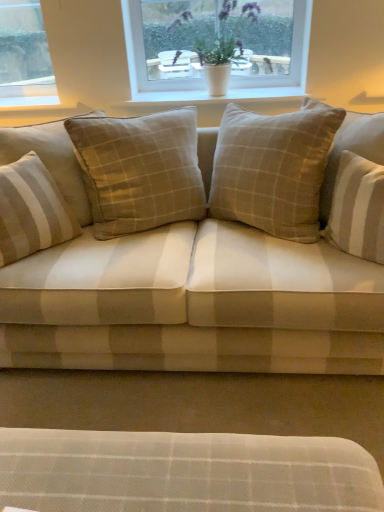
Question: From a real-world perspective, is beige plaid fabric couch at center beneath white plastic window at upper center?

Choices:
 (A) no
 (B) yes

Answer: (B)

Question: Does beige plaid fabric couch at center have a greater height compared to white plastic window at upper center?

Choices:
 (A) no
 (B) yes

Answer: (B)

Question: Is beige plaid fabric couch at center at the left side of white plastic window at upper center?

Choices:
 (A) no
 (B) yes

Answer: (B)

Question: Would you say beige plaid fabric couch at center is outside white plastic window at upper center?

Choices:
 (A) yes
 (B) no

Answer: (A)

Question: Are beige plaid fabric couch at center and white plastic window at upper center located far from each other?

Choices:
 (A) yes
 (B) no

Answer: (B)

Question: Choose the correct answer: Is white plastic window at upper center inside white smooth window sill at upper center or outside it?

Choices:
 (A) inside
 (B) outside

Answer: (B)

Question: Is white plastic window at upper center in front of or behind white smooth window sill at upper center in the image?

Choices:
 (A) front
 (B) behind

Answer: (A)

Question: In terms of size, does white plastic window at upper center appear bigger or smaller than white smooth window sill at upper center?

Choices:
 (A) big
 (B) small

Answer: (A)

Question: In terms of width, does white plastic window at upper center look wider or thinner when compared to white smooth window sill at upper center?

Choices:
 (A) thin
 (B) wide

Answer: (A)

Question: From their relative heights in the image, would you say beige striped cushion at left, placed as the second pillow when sorted from right to left, is taller or shorter than beige plaid fabric couch at center?

Choices:
 (A) tall
 (B) short

Answer: (B)

Question: Is beige striped cushion at left, placed as the second pillow when sorted from right to left, inside or outside of beige plaid fabric couch at center?

Choices:
 (A) outside
 (B) inside

Answer: (B)

Question: In the image, is beige striped cushion at left, placed as the second pillow when sorted from right to left, positioned in front of or behind beige plaid fabric couch at center?

Choices:
 (A) front
 (B) behind

Answer: (B)

Question: From the image's perspective, relative to beige plaid fabric couch at center, is beige striped cushion at left, placed as the second pillow when sorted from right to left, above or below?

Choices:
 (A) below
 (B) above

Answer: (A)

Question: Choose the correct answer: Is white smooth window sill at upper center inside beige checkered pillow at center, positioned as the 2th pillow in left-to-right order, or outside it?

Choices:
 (A) outside
 (B) inside

Answer: (A)

Question: Would you say white smooth window sill at upper center is to the left or to the right of beige checkered pillow at center, which appears as the 1th pillow when viewed from the right, in the picture?

Choices:
 (A) left
 (B) right

Answer: (B)